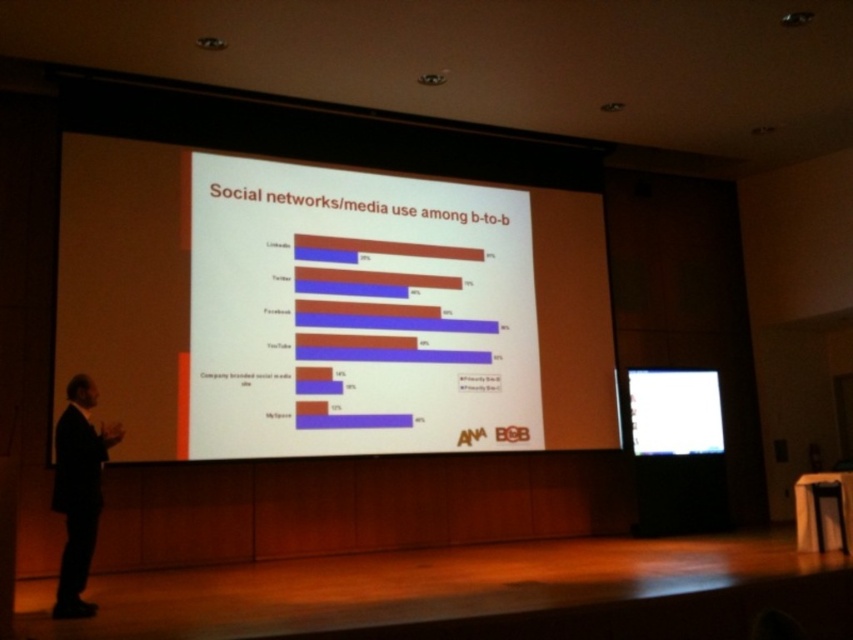
Which is above, white matte projection screen at center or white glossy projector screen at center?

white matte projection screen at center

Between white matte projection screen at center and white glossy projector screen at center, which one has less height?

With less height is white glossy projector screen at center.

This screenshot has height=640, width=853. I want to click on white matte projection screen at center, so click(328, 307).

Between point (56, 486) and point (662, 401), which one is positioned behind?

Positioned behind is point (662, 401).

Can you confirm if black suit at left is bigger than white glossy projector screen at center?

Actually, black suit at left might be smaller than white glossy projector screen at center.

Image resolution: width=853 pixels, height=640 pixels. I want to click on black suit at left, so click(78, 492).

Where is `black suit at left`? The image size is (853, 640). black suit at left is located at coordinates (78, 492).

Is white matte projection screen at center further to the viewer compared to black suit at left?

That is True.

Can you confirm if white matte projection screen at center is thinner than black suit at left?

No, white matte projection screen at center is not thinner than black suit at left.

Does point (144, 150) come in front of point (94, 499)?

That is False.

I want to click on white matte projection screen at center, so click(x=328, y=307).